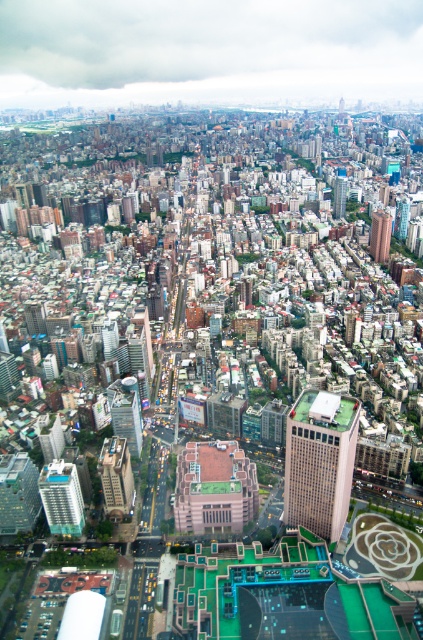
You are a city planner analyzing this urban area. You need to determine which of the two skyscrapers, the matte glass skyscraper at lower left or the blue glass skyscraper at center, has a narrower width to accommodate a new pedestrian walkway. Which one should you choose?

The matte glass skyscraper at lower left has a narrower width than the blue glass skyscraper at center, so it would be the better choice to accommodate the new pedestrian walkway.

You are a drone operator flying a drone that has a maximum flight range of 300 meters. You are instructed to fly your drone to the brick red building at upper right. Can you safely reach it without exceeding the drone range limit?

The brick red building at upper right is 310.53 meters away from camera, so the drone cannot safely reach it without exceeding its maximum flight range of 300 meters.